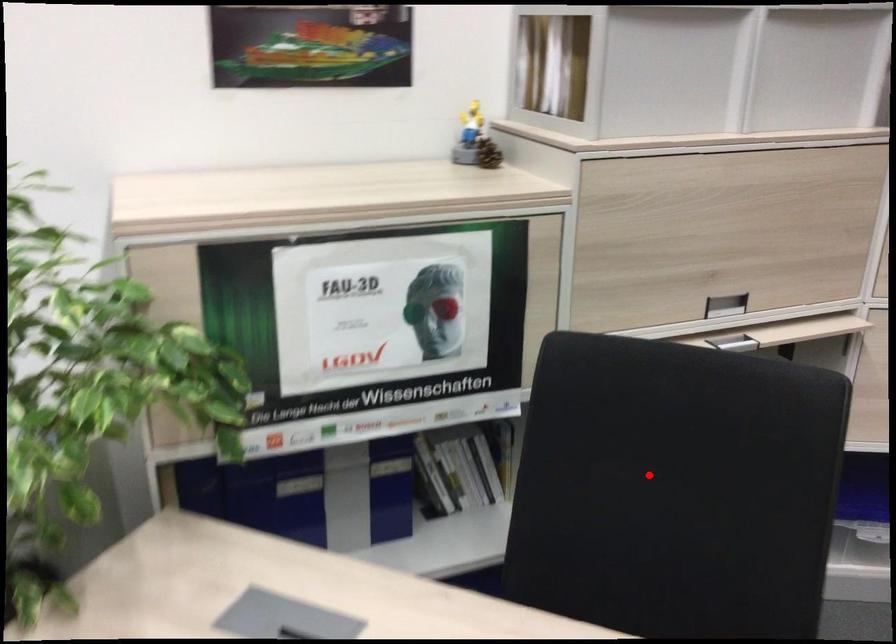
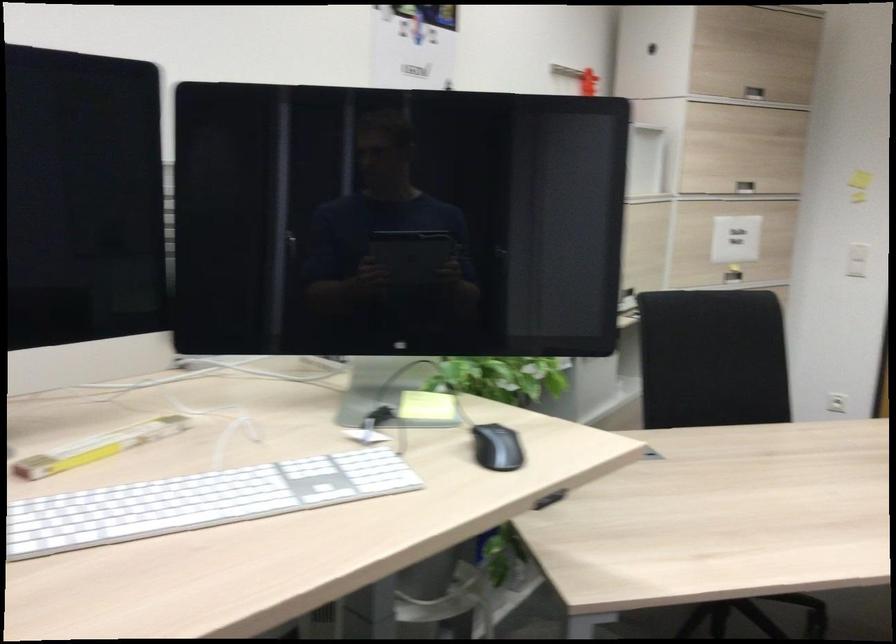
Question: I am providing you with two images of the same scene from different viewpoints. In image1, a red point is highlighted. Considering the same 3D point in image2, which of the following is correct?

Choices:
 (A) It is closer
 (B) It is farther

Answer: (B)